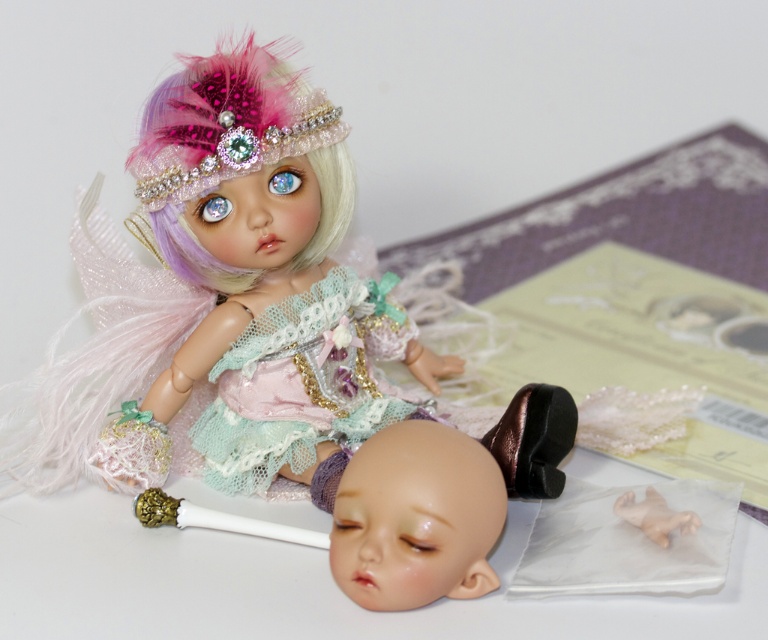
Question: Can you confirm if matte pink fabric doll at upper left is positioned to the right of translucent plastic hand at lower right?

Choices:
 (A) yes
 (B) no

Answer: (B)

Question: Which object is closer to the camera taking this photo?

Choices:
 (A) matte pink fabric doll at upper left
 (B) pastel pink feathered hair at upper left

Answer: (A)

Question: In this image, where is lace fabric dress at center located relative to translucent plastic hand at lower right?

Choices:
 (A) above
 (B) below

Answer: (A)

Question: Which of the following is the farthest from the observer?

Choices:
 (A) (667, 525)
 (B) (339, 193)
 (C) (293, 168)

Answer: (B)

Question: Which of these objects is positioned closest to the matte pink fabric doll at upper left?

Choices:
 (A) lace fabric dress at center
 (B) pastel pink feathered hair at upper left
 (C) translucent plastic hand at lower right

Answer: (A)

Question: Does lace fabric dress at center have a smaller size compared to pastel pink feathered hair at upper left?

Choices:
 (A) yes
 (B) no

Answer: (B)